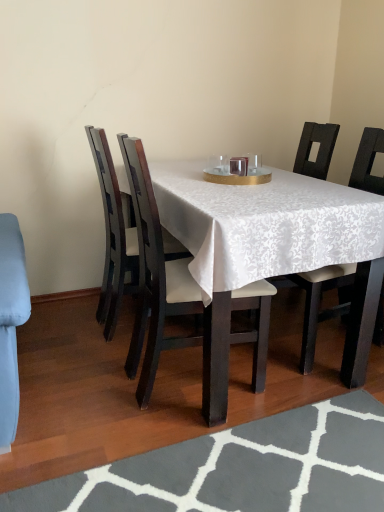
Find the location of a particular element. The image size is (384, 512). free spot in front of gold textured tray at center is located at coordinates 240,189.